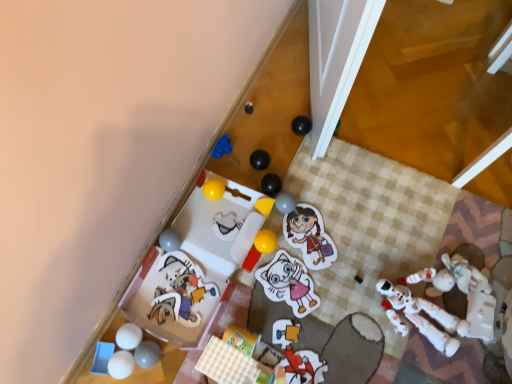
Question: Can you confirm if white matte ball at lower left, arranged as the third toy when viewed from the left, is shorter than white rubber ball at lower left, which is the fourteenth toy from right to left?

Choices:
 (A) yes
 (B) no

Answer: (B)

Question: Is white rubber ball at lower left, which appears as the second toy when viewed from the left, surrounded by white matte ball at lower left, arranged as the third toy when viewed from the left?

Choices:
 (A) yes
 (B) no

Answer: (B)

Question: From the image's perspective, is white matte ball at lower left, the thirteenth toy in the right-to-left sequence, under white rubber ball at lower left, which is the fourteenth toy from right to left?

Choices:
 (A) no
 (B) yes

Answer: (A)

Question: Can you confirm if white matte ball at lower left, the thirteenth toy in the right-to-left sequence, is positioned to the right of white rubber ball at lower left, which is the fourteenth toy from right to left?

Choices:
 (A) yes
 (B) no

Answer: (A)

Question: From a real-world perspective, is white matte ball at lower left, arranged as the third toy when viewed from the left, on white rubber ball at lower left, which appears as the second toy when viewed from the left?

Choices:
 (A) no
 (B) yes

Answer: (A)

Question: From a real-world perspective, is white matte ball at lower left, the thirteenth toy in the right-to-left sequence, positioned under white rubber ball at lower left, which appears as the second toy when viewed from the left, based on gravity?

Choices:
 (A) no
 (B) yes

Answer: (B)

Question: Can you confirm if white rubber ball at lower left, which appears as the second toy when viewed from the left, is taller than yellow rubber ball at center, the tenth toy when ordered from right to left?

Choices:
 (A) yes
 (B) no

Answer: (B)

Question: Considering the relative sizes of white rubber ball at lower left, which appears as the second toy when viewed from the left, and yellow rubber ball at center, placed as the 6th toy when sorted from left to right, in the image provided, is white rubber ball at lower left, which appears as the second toy when viewed from the left, wider than yellow rubber ball at center, placed as the 6th toy when sorted from left to right,?

Choices:
 (A) yes
 (B) no

Answer: (B)

Question: From the image's perspective, is white rubber ball at lower left, which is the fourteenth toy from right to left, over yellow rubber ball at center, the tenth toy when ordered from right to left?

Choices:
 (A) yes
 (B) no

Answer: (B)

Question: Considering the relative sizes of white rubber ball at lower left, which is the fourteenth toy from right to left, and yellow rubber ball at center, the tenth toy when ordered from right to left, in the image provided, is white rubber ball at lower left, which is the fourteenth toy from right to left, smaller than yellow rubber ball at center, the tenth toy when ordered from right to left,?

Choices:
 (A) no
 (B) yes

Answer: (B)

Question: Considering the relative positions of white rubber ball at lower left, which appears as the second toy when viewed from the left, and yellow rubber ball at center, placed as the 6th toy when sorted from left to right, in the image provided, is white rubber ball at lower left, which appears as the second toy when viewed from the left, behind yellow rubber ball at center, placed as the 6th toy when sorted from left to right,?

Choices:
 (A) no
 (B) yes

Answer: (A)

Question: Could you tell me if white rubber ball at lower left, which is the fourteenth toy from right to left, is turned towards yellow rubber ball at center, placed as the 6th toy when sorted from left to right?

Choices:
 (A) no
 (B) yes

Answer: (A)

Question: Does blue plastic tray at lower left, the fifteenth toy from the right, have a greater height compared to yellow matte block at upper center, placed as the 11th toy when sorted from left to right?

Choices:
 (A) yes
 (B) no

Answer: (A)